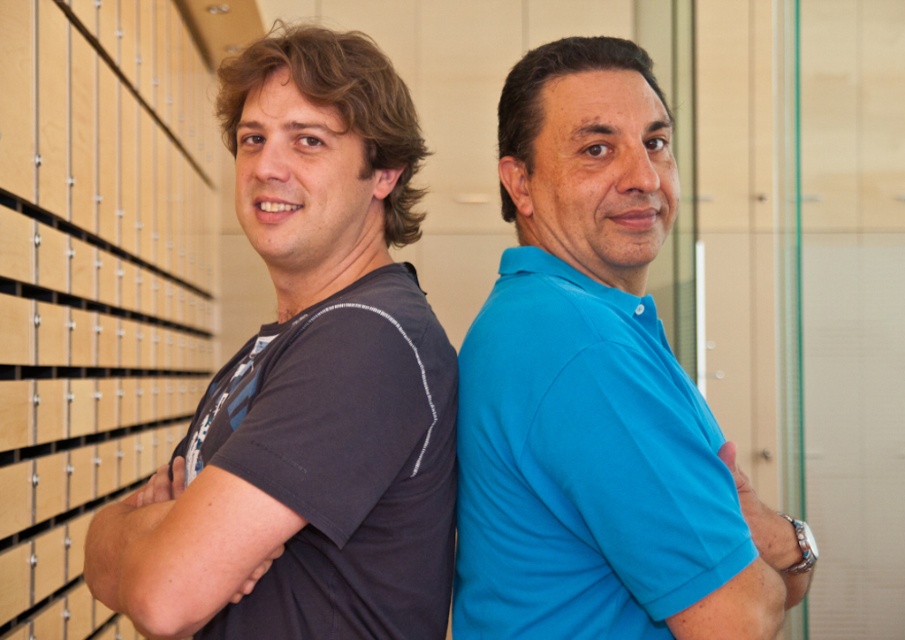
Is wooden at left below blue smooth shirt at right?

No, wooden at left is not below blue smooth shirt at right.

Between wooden at left and blue smooth shirt at right, which one is positioned lower?

blue smooth shirt at right is below.

This screenshot has width=905, height=640. What do you see at coordinates (93, 282) in the screenshot?
I see `wooden at left` at bounding box center [93, 282].

Where is `wooden at left`? The height and width of the screenshot is (640, 905). wooden at left is located at coordinates (93, 282).

Is blue smooth polo shirt at center in front of wooden at left?

Yes.

Which is more to the left, blue smooth polo shirt at center or wooden at left?

wooden at left

Which is behind, point (531, 493) or point (183, 337)?

Positioned behind is point (183, 337).

Locate an element on the screen. The height and width of the screenshot is (640, 905). blue smooth polo shirt at center is located at coordinates (598, 392).

In order to click on wooden at left in this screenshot , I will do `click(93, 282)`.

Who is more forward, [195,99] or [158,589]?

Point [158,589]

At what (x,y) coordinates should I click in order to perform the action: click on wooden at left. Please return your answer as a coordinate pair (x, y). This screenshot has height=640, width=905. Looking at the image, I should click on (93, 282).